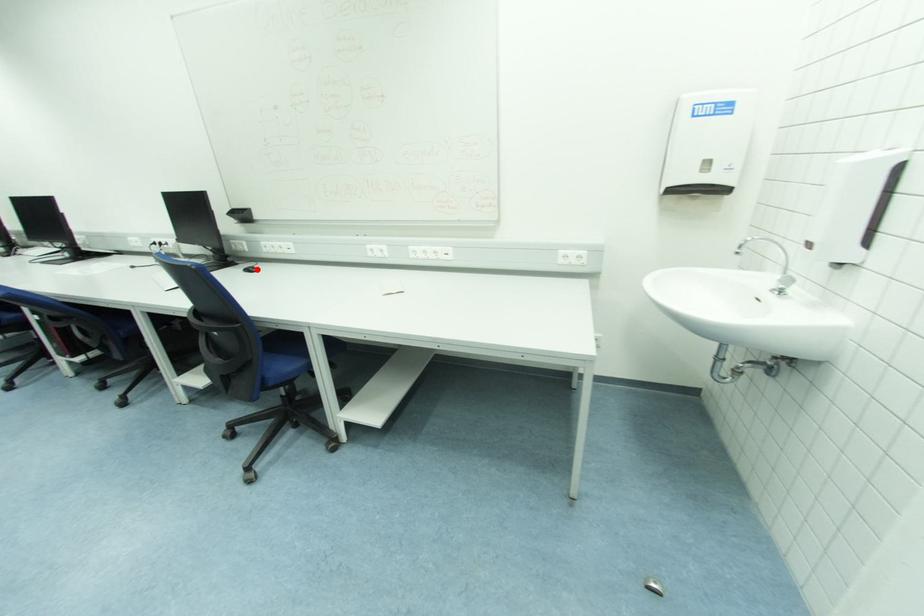
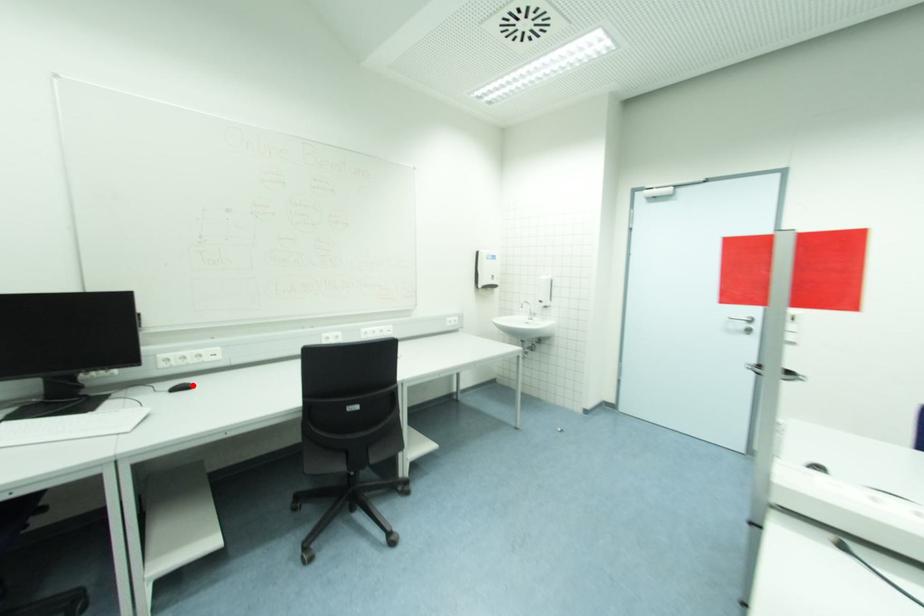
I am providing you with two images of the same scene from different viewpoints. A red point is marked on the first image and another point is marked on the second image. Does the point marked in image1 correspond to the same location as the one in image2?

Yes